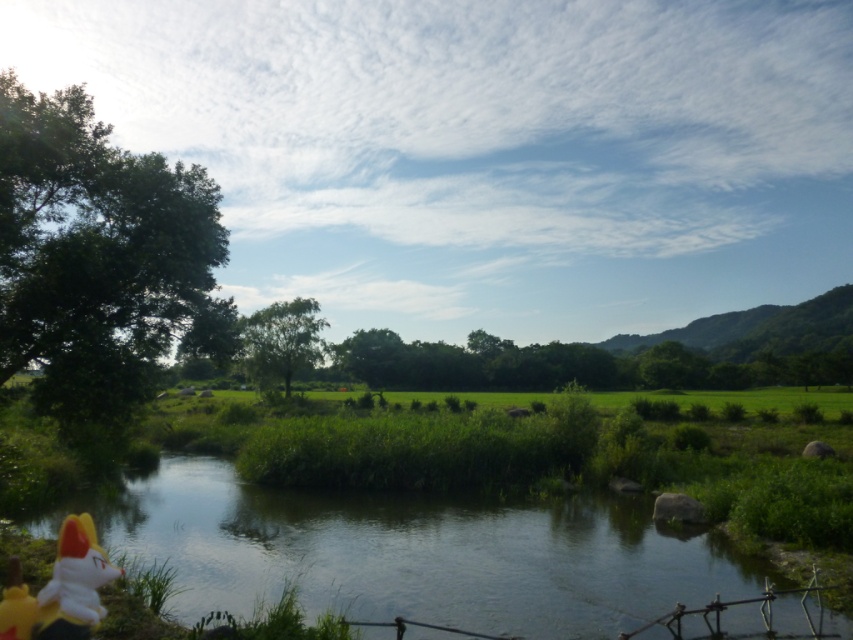
Does green leafy tree at left appear on the right side of green leafy tree at center?

Correct, you'll find green leafy tree at left to the right of green leafy tree at center.

Between green leafy tree at left and green leafy tree at center, which one is positioned lower?

green leafy tree at left is lower down.

This screenshot has height=640, width=853. What are the coordinates of `green leafy tree at left` in the screenshot? It's located at (99, 260).

In order to click on green leafy tree at left in this screenshot , I will do click(x=99, y=260).

Who is more forward, (299, 595) or (265, 316)?

Positioned in front is point (299, 595).

Is green grassy river at lower center in front of green leafy tree at center?

That is True.

You are a GUI agent. You are given a task and a screenshot of the screen. Output one action in this format:
    pyautogui.click(x=<x>, y=<y>)
    Task: Click on the green grassy river at lower center
    
    Given the screenshot: What is the action you would take?
    pyautogui.click(x=418, y=554)

Between point (364, 612) and point (10, 230), which one is positioned behind?

The point (364, 612) is behind.

Who is more forward, (705, 566) or (102, 340)?

Point (102, 340) is in front.

Find the location of a particular element. The image size is (853, 640). green grassy river at lower center is located at coordinates (418, 554).